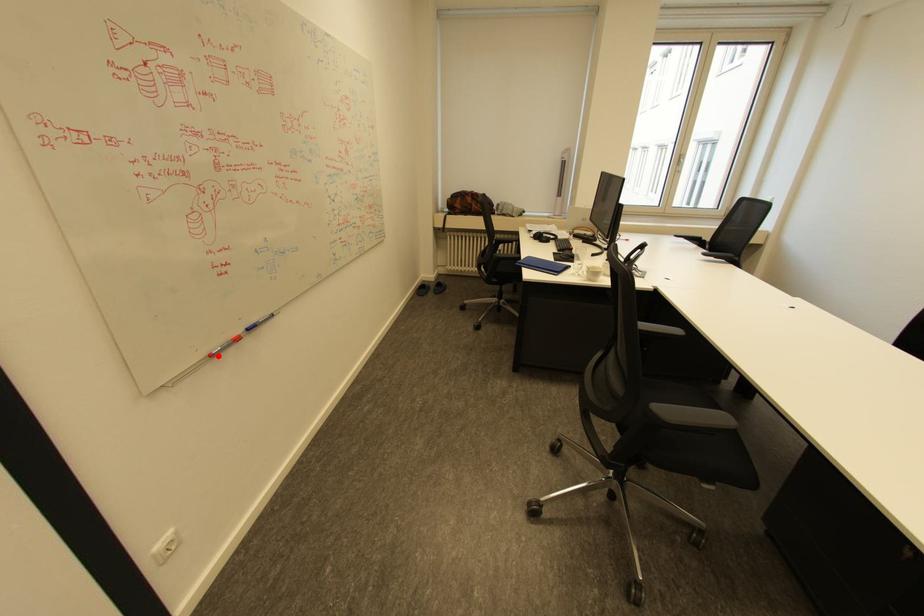
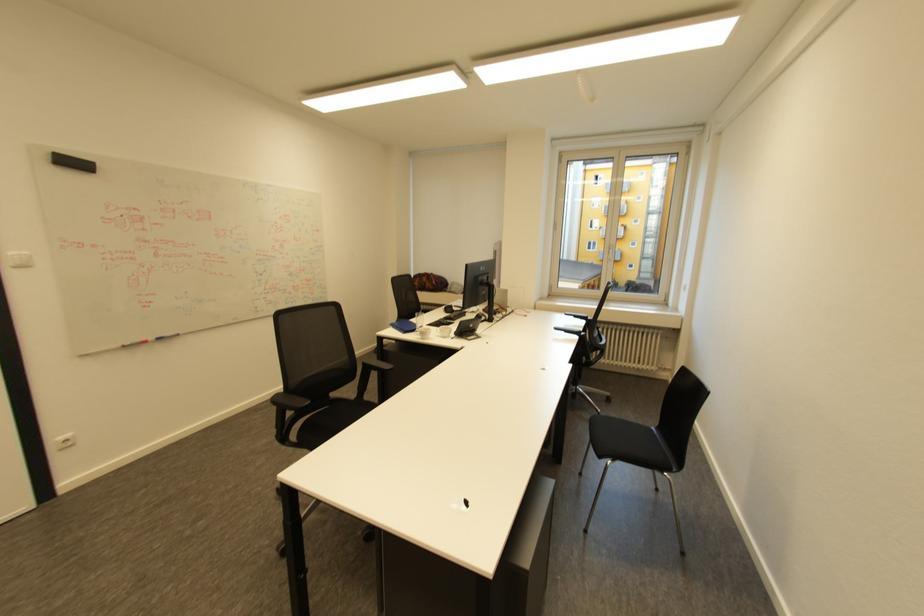
Find the pixel in the second image that matches the highlighted location in the first image.

(128, 346)